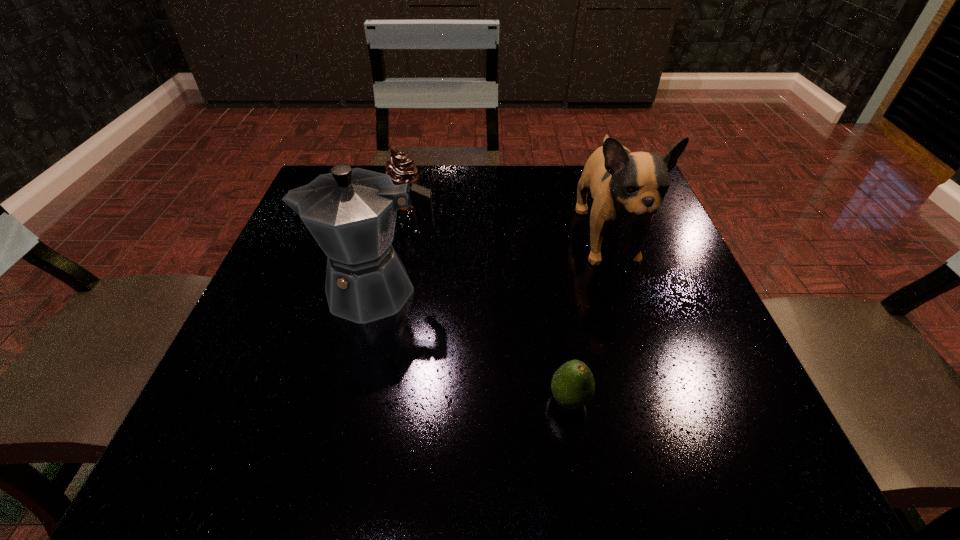
The width and height of the screenshot is (960, 540). I want to click on the second closest object to the avocado, so click(351, 213).

At what (x,y) coordinates should I click in order to perform the action: click on object that is the third closest to the rightmost object. Please return your answer as a coordinate pair (x, y). Looking at the image, I should click on (401, 169).

This screenshot has width=960, height=540. Find the location of `free space that satisfies the following two spatial constraints: 1. at the spout of the coffeepot; 2. on the right side of the nearest object`. free space that satisfies the following two spatial constraints: 1. at the spout of the coffeepot; 2. on the right side of the nearest object is located at coordinates (351, 400).

The height and width of the screenshot is (540, 960). Identify the location of free space that satisfies the following two spatial constraints: 1. at the spout of the coffeepot; 2. on the back side of the avocado. (351, 400).

Identify the location of free region that satisfies the following two spatial constraints: 1. at the spout of the avocado; 2. on the left side of the coffeepot. This screenshot has height=540, width=960. pyautogui.click(x=351, y=400).

This screenshot has height=540, width=960. I want to click on free spot that satisfies the following two spatial constraints: 1. at the spout of the coffeepot; 2. on the back side of the avocado, so click(351, 400).

I want to click on vacant space that satisfies the following two spatial constraints: 1. at the face of the puppy; 2. at the spout of the coffeepot, so click(x=624, y=290).

Where is `free location that satisfies the following two spatial constraints: 1. at the face of the rightmost object; 2. at the spout of the coffeepot`? The image size is (960, 540). free location that satisfies the following two spatial constraints: 1. at the face of the rightmost object; 2. at the spout of the coffeepot is located at coordinates (x=624, y=290).

Locate an element on the screen. vacant space that satisfies the following two spatial constraints: 1. at the face of the rightmost object; 2. at the spout of the coffeepot is located at coordinates (624, 290).